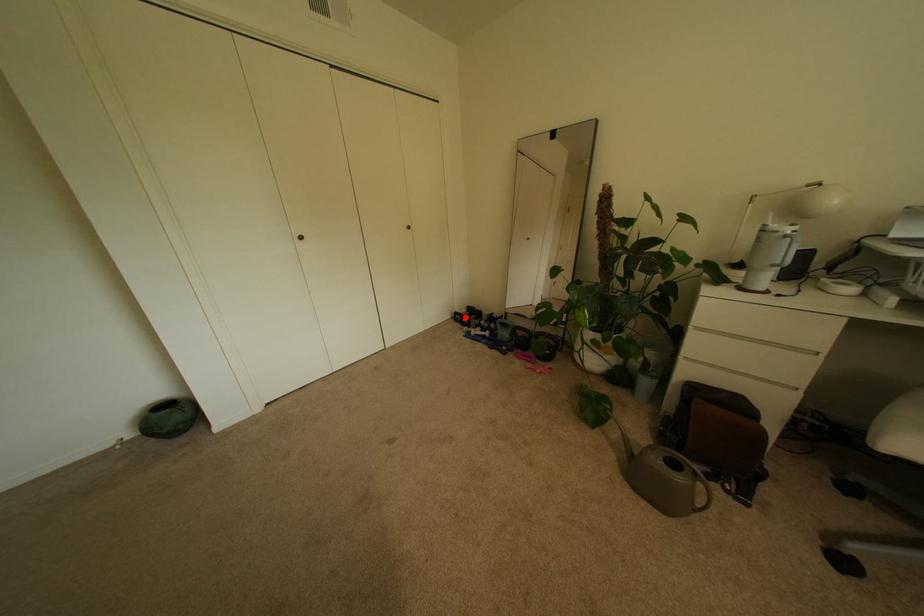
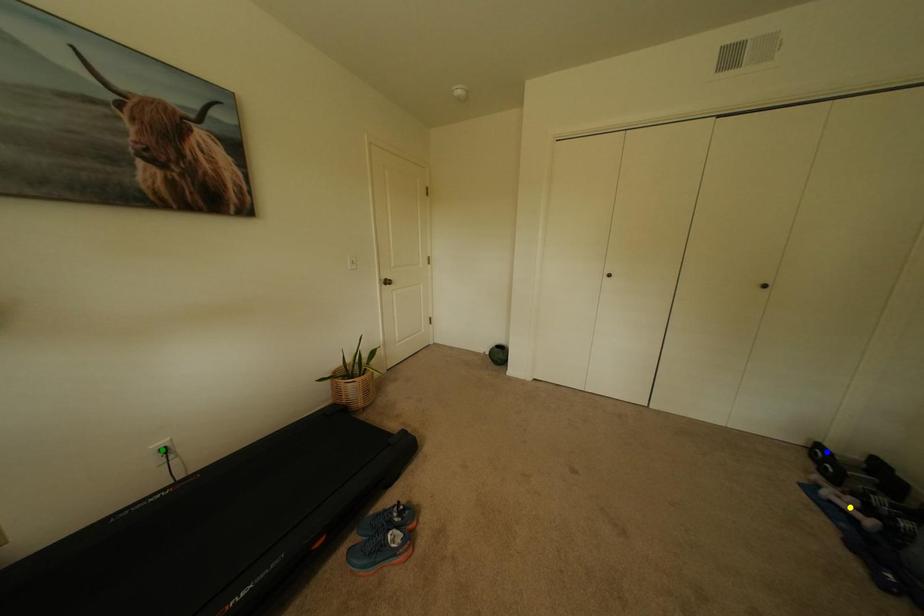
Question: I am providing you with two images of the same scene from different viewpoints. A red point is marked on the first image. You are given multiple points on the second image. Can you choose the point in image 2 that corresponds to the point in image 1?

Choices:
 (A) green point
 (B) blue point
 (C) yellow point

Answer: (B)